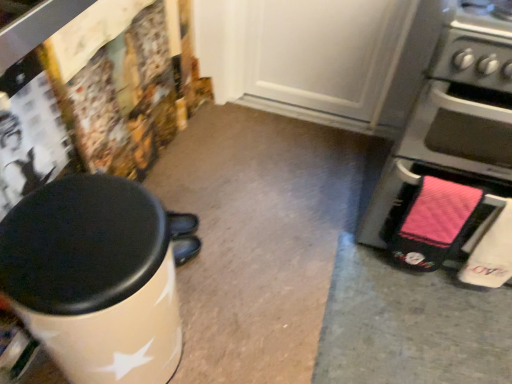
Find the location of a particular element. Image resolution: width=512 pixels, height=384 pixels. free space above white glossy waste container at left (from a real-world perspective) is located at coordinates (78, 234).